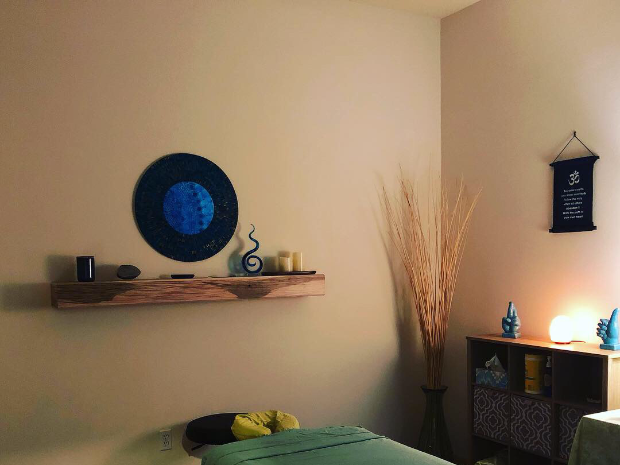
Where is `tissue`? tissue is located at coordinates (490, 358).